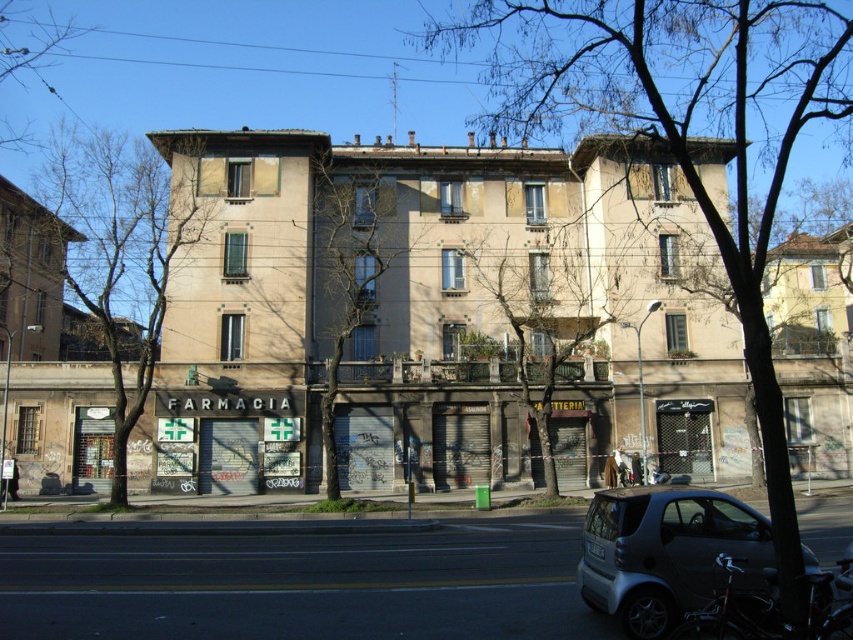
You are standing in front of the building and want to locate the brown textured tree at upper center. What are the coordinates where you can find it?

The brown textured tree at upper center is located at coordinates point (685, 131).

You are a pedestrian standing in front of the building and want to take a photo of the pharmacy sign. However, the shiny black bicycle at lower right is blocking your view. Can you move around to the left side of the brown textured tree at upper center to get an unobstructed view of the pharmacy sign?

The shiny black bicycle at lower right is behind the brown textured tree at upper center, so moving to the left side of the brown textured tree at upper center would place the bicycle behind the tree, allowing you to see the pharmacy sign without obstruction.